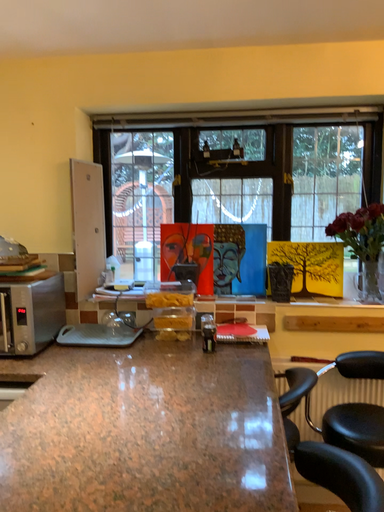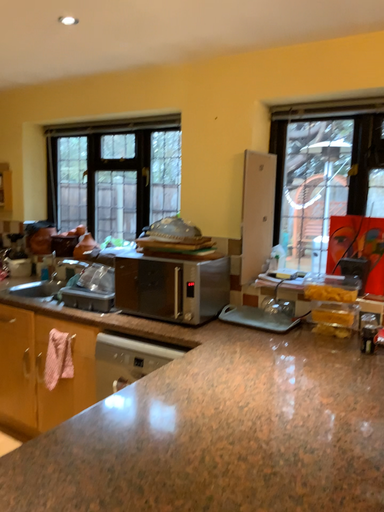
Question: How did the camera likely rotate when shooting the video?

Choices:
 (A) rotated right
 (B) rotated left

Answer: (B)